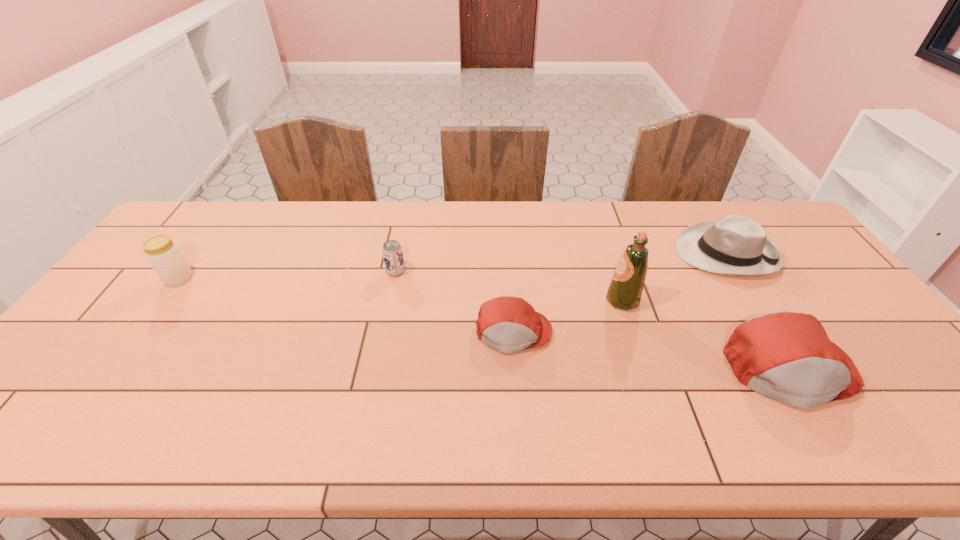
This screenshot has height=540, width=960. In order to click on vacant position located on the front-facing side of the fedora in this screenshot , I will do `click(605, 253)`.

This screenshot has height=540, width=960. I want to click on vacant region located on the front-facing side of the fedora, so click(x=564, y=253).

I want to click on blank space located 0.070m on the right of the second object from left to right, so click(428, 272).

Find the location of a particular element. vacant space located 0.230m on the front-facing side of the tallest object is located at coordinates (523, 300).

The height and width of the screenshot is (540, 960). Identify the location of free space located 0.360m on the front-facing side of the tallest object. (477, 300).

Where is `vacant space located 0.150m on the front-facing side of the tallest object`? vacant space located 0.150m on the front-facing side of the tallest object is located at coordinates (552, 300).

Identify the location of free spot located on the right of the leftmost object. (212, 279).

This screenshot has height=540, width=960. I want to click on object located in the far edge section of the desktop, so click(736, 245).

Locate an element on the screen. Image resolution: width=960 pixels, height=540 pixels. object situated at the near edge is located at coordinates (787, 356).

At what (x,y) coordinates should I click in order to perform the action: click on object that is at the left edge. Please return your answer as a coordinate pair (x, y). Looking at the image, I should click on (164, 256).